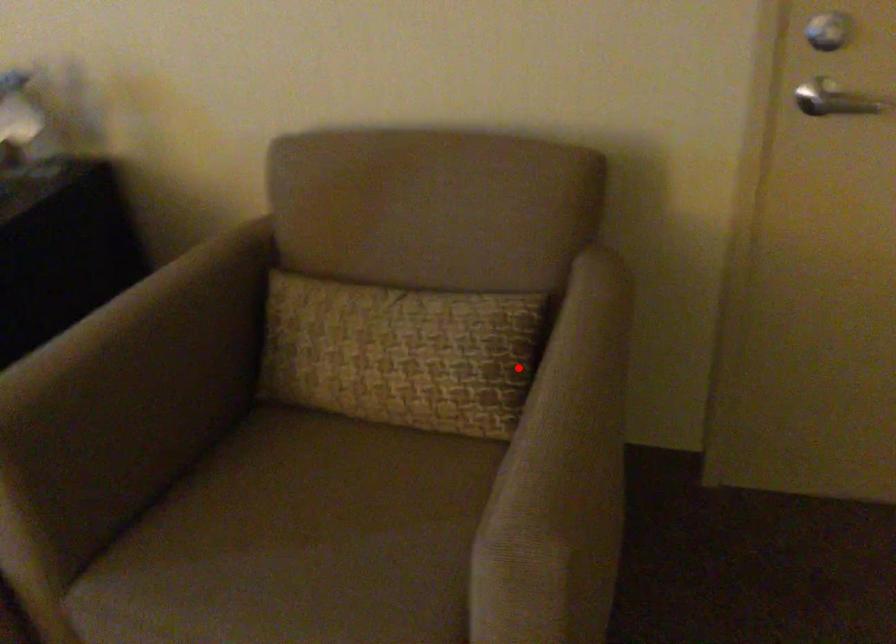
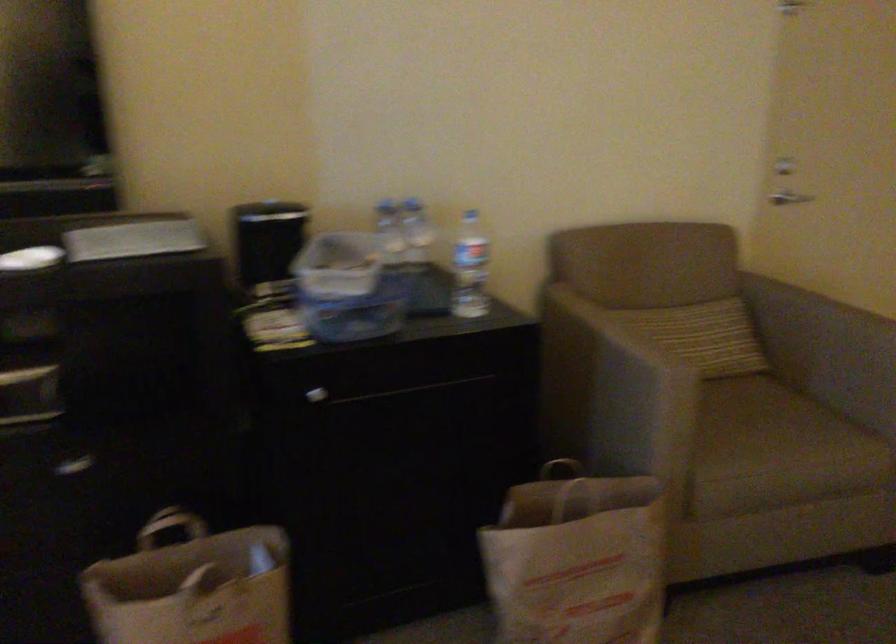
Question: I am providing you with two images of the same scene from different viewpoints. Given a red point in image1, look at the same physical point in image2. Is it:

Choices:
 (A) Closer to the viewpoint
 (B) Farther from the viewpoint

Answer: (B)